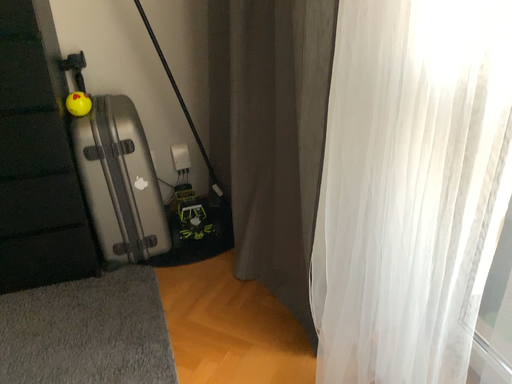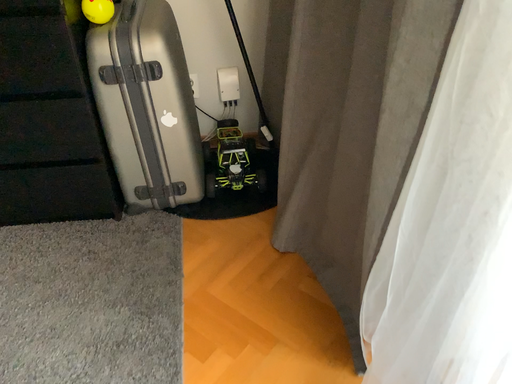
Question: How did the camera likely rotate when shooting the video?

Choices:
 (A) rotated upward
 (B) rotated downward

Answer: (B)